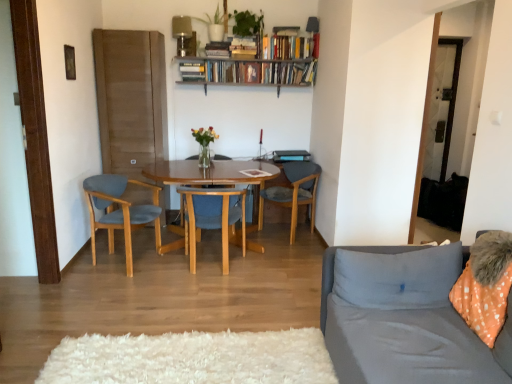
Question: Do you think hardcover book at upper center, which is the third book from right to left, is within hardcover books at upper center, which appears as the 1th book when viewed from the right, or outside of it?

Choices:
 (A) outside
 (B) inside

Answer: (A)

Question: Is point (193, 72) positioned closer to the camera than point (265, 46)?

Choices:
 (A) farther
 (B) closer

Answer: (A)

Question: Which object is the closest to the blue fabric chair at center, which is counted as the 2th chair, starting from the right?

Choices:
 (A) matte blue chair at left, the third chair in the right-to-left sequence
 (B) hardcover book at upper center, which is the first book in left-to-right order
 (C) hardcover books at upper center, placed as the 2th book when sorted from right to left
 (D) gray fabric pillow at right
 (E) metallic silver lamp at upper center, which is the 2th lamp from right to left

Answer: (A)

Question: Which object is positioned closest to the metallic silver lamp at upper center, which is the 2th lamp from right to left?

Choices:
 (A) hardcover books at upper center, the 2th book positioned from the left
 (B) blue fabric chair at center, which is counted as the 2th chair, starting from the right
 (C) green matte plant at upper center, the 1th houseplant when ordered from right to left
 (D) gray fabric couch at right
 (E) green matte plant at upper center, which ranks as the second houseplant in right-to-left order

Answer: (E)